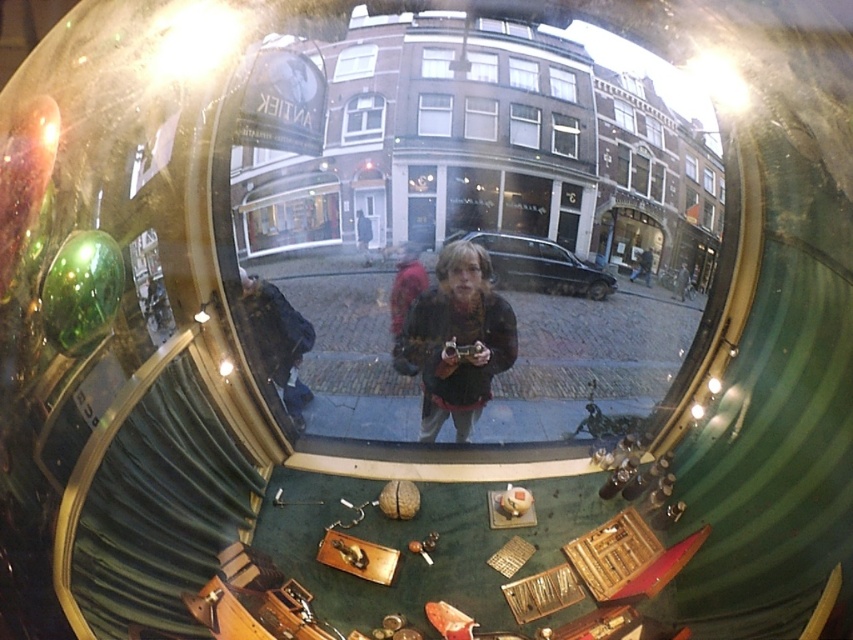
You are standing in front of the shop window and want to touch the object at point (648, 312). Can you reach it without moving your hand more than 12 inches?

The distance between you and the point (648, 312) is 12.59 inches, which is slightly more than 12 inches. Therefore, you cannot reach it without moving your hand further.

You are standing inside the shop and looking through the window. You see the matte black camera at center and the dark blue jacket at center reflected in the window. Which object is closer to you?

The matte black camera at center is closer to the viewer than the dark blue jacket at center, so the camera is closer to you.